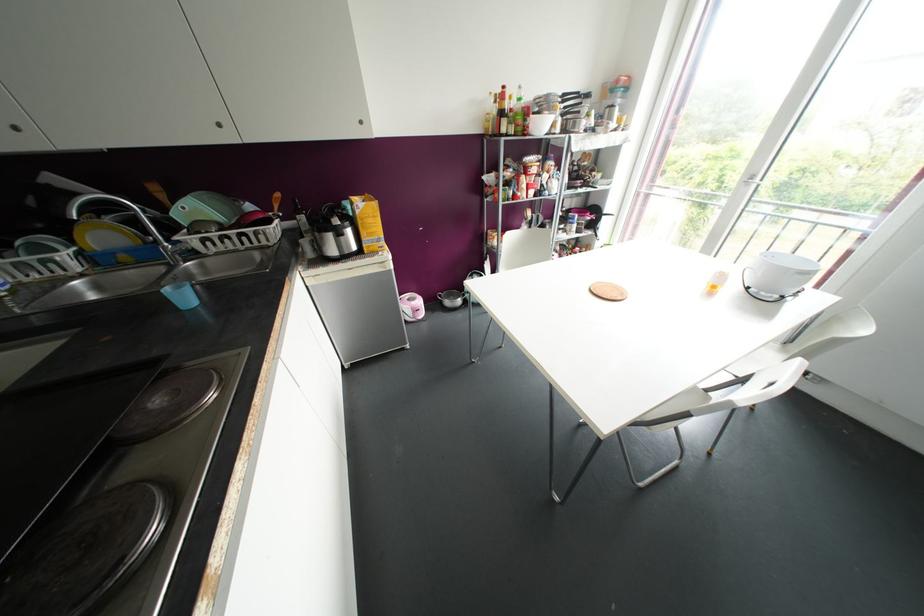
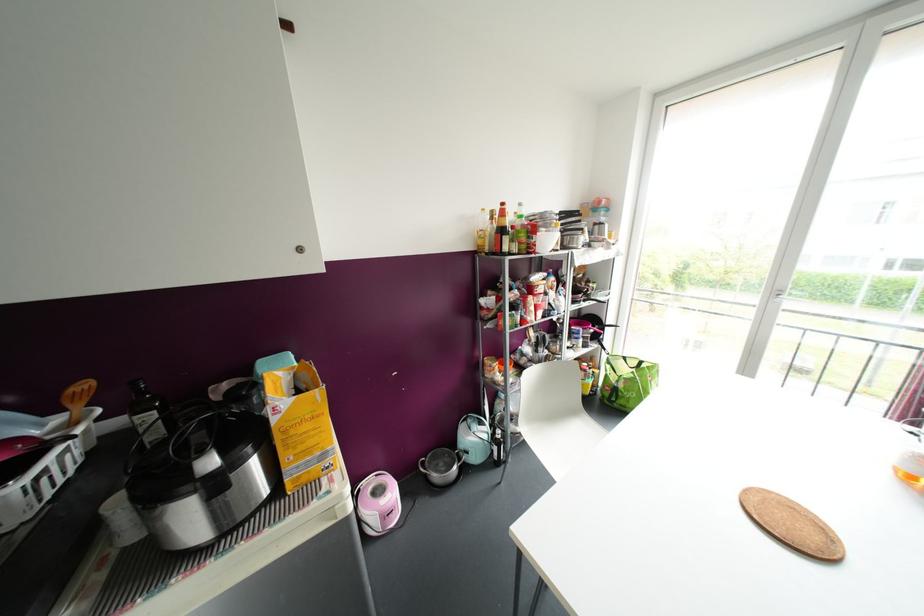
Question: The first image is from the beginning of the video and the second image is from the end. How did the camera likely rotate when shooting the video?

Choices:
 (A) Left
 (B) Right
 (C) Up
 (D) Down

Answer: (C)